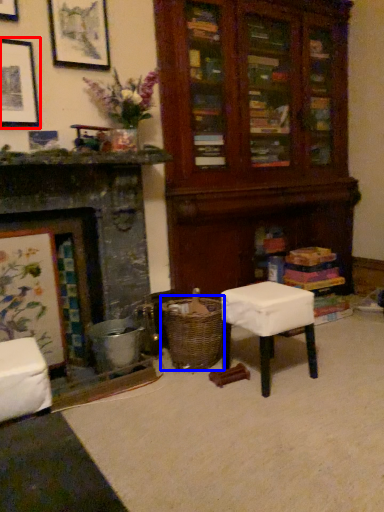
Question: Which of the following is the farthest to the observer, picture frame (highlighted by a red box) or crate (highlighted by a blue box)?

Choices:
 (A) picture frame
 (B) crate

Answer: (B)